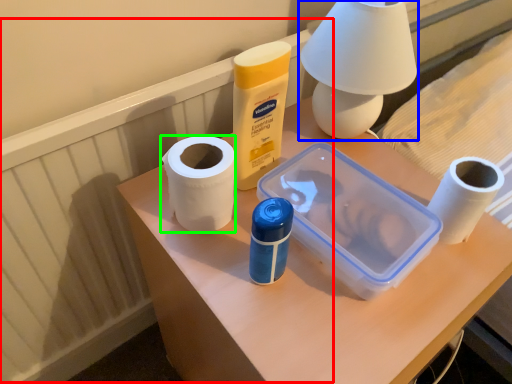
Question: Which object is positioned closest to radiator (highlighted by a red box)? Select from table lamp (highlighted by a blue box) and paper towel (highlighted by a green box).

Choices:
 (A) table lamp
 (B) paper towel

Answer: (B)